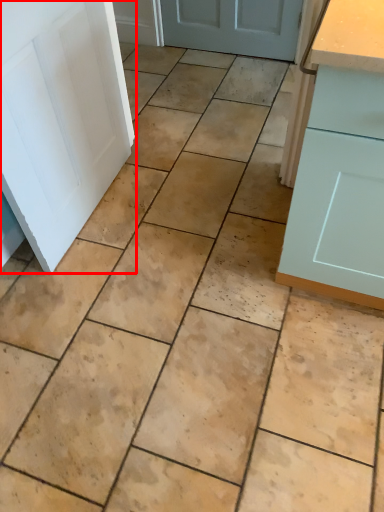
Question: Considering the relative positions of door (annotated by the red box) and cabinetry in the image provided, where is door (annotated by the red box) located with respect to the staircase?

Choices:
 (A) left
 (B) right

Answer: (A)